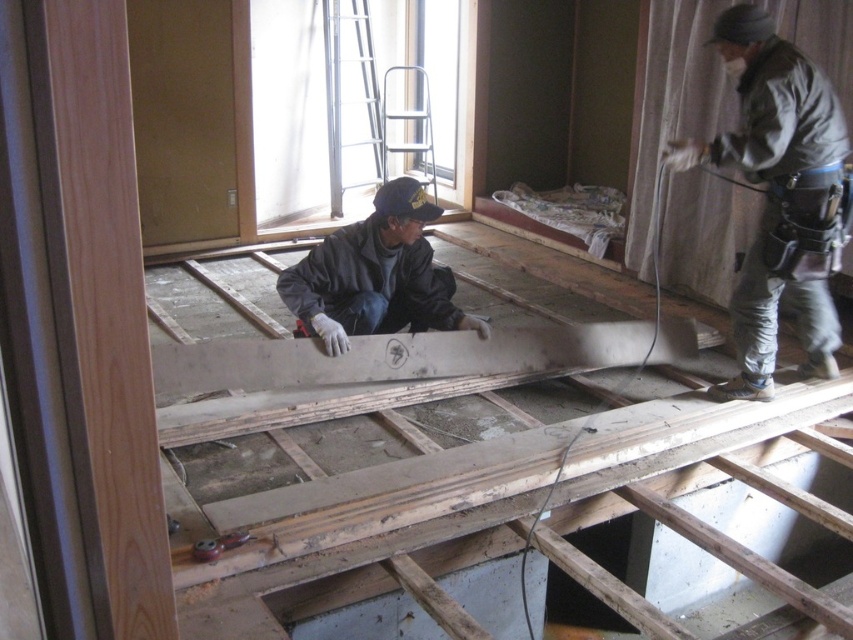
Is point (788, 164) less distant than point (354, 257)?

Yes, it is in front of point (354, 257).

Can you confirm if gray fabric construction worker at right is wider than black matte jacket at center?

No.

The width and height of the screenshot is (853, 640). I want to click on gray fabric construction worker at right, so click(x=772, y=188).

I want to click on gray fabric construction worker at right, so click(772, 188).

Does gray fabric construction worker at right have a larger size compared to metallic silver ladder at upper center?

Actually, gray fabric construction worker at right might be smaller than metallic silver ladder at upper center.

Can you confirm if gray fabric construction worker at right is positioned above metallic silver ladder at upper center?

No, gray fabric construction worker at right is not above metallic silver ladder at upper center.

Does point (666, 141) come farther from viewer compared to point (340, 19)?

That is False.

Locate an element on the screen. The width and height of the screenshot is (853, 640). gray fabric construction worker at right is located at coordinates (772, 188).

Does black matte jacket at center have a greater width compared to metallic silver ladder at upper center?

Correct, the width of black matte jacket at center exceeds that of metallic silver ladder at upper center.

Which of these two, black matte jacket at center or metallic silver ladder at upper center, stands taller?

Standing taller between the two is metallic silver ladder at upper center.

The height and width of the screenshot is (640, 853). What do you see at coordinates (375, 275) in the screenshot?
I see `black matte jacket at center` at bounding box center [375, 275].

You are a GUI agent. You are given a task and a screenshot of the screen. Output one action in this format:
    pyautogui.click(x=<x>, y=<y>)
    Task: Click on the black matte jacket at center
    
    Given the screenshot: What is the action you would take?
    pyautogui.click(x=375, y=275)